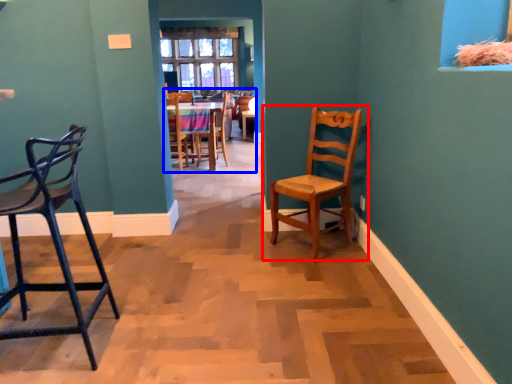
Question: Which of the following is the farthest to the observer, chair (highlighted by a red box) or chair (highlighted by a blue box)?

Choices:
 (A) chair
 (B) chair

Answer: (B)